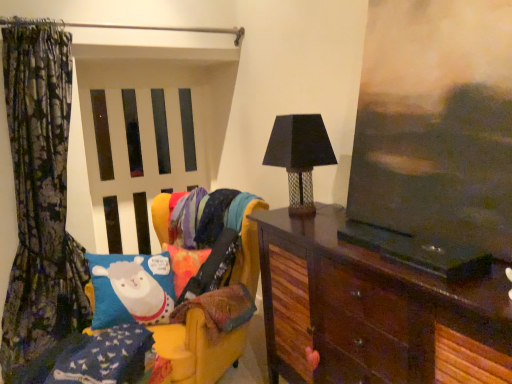
What do you see at coordinates (137, 156) in the screenshot? The width and height of the screenshot is (512, 384). I see `white matte screen door at center` at bounding box center [137, 156].

I want to click on white matte screen door at center, so click(137, 156).

What is the approximate height of dark wood cabinet at right?

dark wood cabinet at right is 1.00 meters in height.

I want to click on white matte screen door at center, so click(x=137, y=156).

Considering the sizes of dark wood cabinet at right and floral fabric curtain at left in the image, is dark wood cabinet at right wider or thinner than floral fabric curtain at left?

dark wood cabinet at right is wider than floral fabric curtain at left.

Is dark wood cabinet at right facing towards floral fabric curtain at left?

No, dark wood cabinet at right is not facing towards floral fabric curtain at left.

From a real-world perspective, is dark wood cabinet at right positioned above or below floral fabric curtain at left?

dark wood cabinet at right is situated lower than floral fabric curtain at left in the real world.

Does dark wood cabinet at right touch floral fabric curtain at left?

No, dark wood cabinet at right is not with floral fabric curtain at left.

Is dark wood cabinet at right next to velvet yellow swivel chair at left?

They are not placed beside each other.

In the scene shown: Between dark wood cabinet at right and velvet yellow swivel chair at left, which one appears on the left side from the viewer's perspective?

From the viewer's perspective, velvet yellow swivel chair at left appears more on the left side.

Is point (451, 374) less distant than point (253, 282)?

Yes, it is.

In the scene shown: Is dark wood cabinet at right oriented towards velvet yellow swivel chair at left?

No, dark wood cabinet at right is not facing towards velvet yellow swivel chair at left.

Measure the distance between velvet yellow swivel chair at left and white matte screen door at center.

velvet yellow swivel chair at left is 4.99 feet from white matte screen door at center.

From the picture: Considering the relative positions of velvet yellow swivel chair at left and white matte screen door at center in the image provided, is velvet yellow swivel chair at left in front of white matte screen door at center?

Yes, velvet yellow swivel chair at left is closer to the viewer.

From a real-world perspective, is velvet yellow swivel chair at left positioned under white matte screen door at center based on gravity?

Yes, from a real-world perspective, velvet yellow swivel chair at left is under white matte screen door at center.

From the image's perspective, which is below, velvet yellow swivel chair at left or white matte screen door at center?

velvet yellow swivel chair at left, from the image's perspective.

Is white matte screen door at center at the back of dark wood cabinet at right?

No, dark wood cabinet at right is not facing the opposite direction of white matte screen door at center.

Looking at this image, is dark wood cabinet at right next to white matte screen door at center?

No, dark wood cabinet at right is not making contact with white matte screen door at center.

From a real-world perspective, is dark wood cabinet at right located higher than white matte screen door at center?

Answer: Actually, dark wood cabinet at right is physically below white matte screen door at center in the real world.

From the image's perspective, which one is positioned higher, velvet yellow swivel chair at left or floral fabric curtain at left?

From the image's view, floral fabric curtain at left is above.

Relative to floral fabric curtain at left, is velvet yellow swivel chair at left in front or behind?

In the image, velvet yellow swivel chair at left appears in front of floral fabric curtain at left.

In terms of height, does velvet yellow swivel chair at left look taller or shorter compared to floral fabric curtain at left?

Considering their sizes, velvet yellow swivel chair at left has less height than floral fabric curtain at left.

Is velvet yellow swivel chair at left wider or thinner than floral fabric curtain at left?

velvet yellow swivel chair at left is wider than floral fabric curtain at left.

Is black mesh table lamp at center right at the back of floral fabric curtain at left?

No, black mesh table lamp at center right is not at the back of floral fabric curtain at left.

Would you say floral fabric curtain at left is inside or outside black mesh table lamp at center right?

floral fabric curtain at left is outside black mesh table lamp at center right.

From the image's perspective, is floral fabric curtain at left under black mesh table lamp at center right?

Indeed, from the image's perspective, floral fabric curtain at left is shown beneath black mesh table lamp at center right.

Which of these two, white matte screen door at center or floral fabric curtain at left, is wider?

floral fabric curtain at left.

Considering the sizes of objects white matte screen door at center and floral fabric curtain at left in the image provided, who is taller, white matte screen door at center or floral fabric curtain at left?

floral fabric curtain at left.

Considering the positions of objects white matte screen door at center and floral fabric curtain at left in the image provided, who is more to the left, white matte screen door at center or floral fabric curtain at left?

floral fabric curtain at left is more to the left.

Identify the location of curtain located on the left of dark wood cabinet at right. The height and width of the screenshot is (384, 512). (40, 196).

Locate an element on the screen. Image resolution: width=512 pixels, height=384 pixels. swivel chair that appears below the dark wood cabinet at right (from a real-world perspective) is located at coordinates (197, 349).

From the image, which object appears to be farther from black mesh table lamp at center right, floral fabric curtain at left or white matte screen door at center?

Among the two, white matte screen door at center is located further to black mesh table lamp at center right.

Based on the photo, based on their spatial positions, is white matte screen door at center or floral fabric curtain at left further from velvet yellow swivel chair at left?

white matte screen door at center lies further to velvet yellow swivel chair at left than the other object.

Looking at the image, which one is located closer to white matte screen door at center, floral fabric curtain at left or dark wood cabinet at right?

Among the two, floral fabric curtain at left is located nearer to white matte screen door at center.

When comparing their distances from velvet yellow swivel chair at left, does black mesh table lamp at center right or dark wood cabinet at right seem closer?

dark wood cabinet at right.

Looking at the image, which one is located further to dark wood cabinet at right, black mesh table lamp at center right or floral fabric curtain at left?

floral fabric curtain at left lies further to dark wood cabinet at right than the other object.

Which object lies further to the anchor point black mesh table lamp at center right, velvet yellow swivel chair at left or floral fabric curtain at left?

floral fabric curtain at left.

Estimate the real-world distances between objects in this image. Which object is further from velvet yellow swivel chair at left, black mesh table lamp at center right or floral fabric curtain at left?

Based on the image, floral fabric curtain at left appears to be further to velvet yellow swivel chair at left.

Estimate the real-world distances between objects in this image. Which object is closer to white matte screen door at center, dark wood cabinet at right or floral fabric curtain at left?

Based on the image, floral fabric curtain at left appears to be nearer to white matte screen door at center.

Locate an element on the screen. The height and width of the screenshot is (384, 512). table lamp between dark wood cabinet at right and white matte screen door at center from front to back is located at coordinates (298, 156).

Image resolution: width=512 pixels, height=384 pixels. Find the location of `swivel chair located between dark wood cabinet at right and white matte screen door at center in the depth direction`. swivel chair located between dark wood cabinet at right and white matte screen door at center in the depth direction is located at coordinates (197, 349).

The width and height of the screenshot is (512, 384). I want to click on curtain between dark wood cabinet at right and white matte screen door at center from front to back, so click(x=40, y=196).

Locate an element on the screen. Image resolution: width=512 pixels, height=384 pixels. swivel chair located between floral fabric curtain at left and black mesh table lamp at center right in the left-right direction is located at coordinates (197, 349).